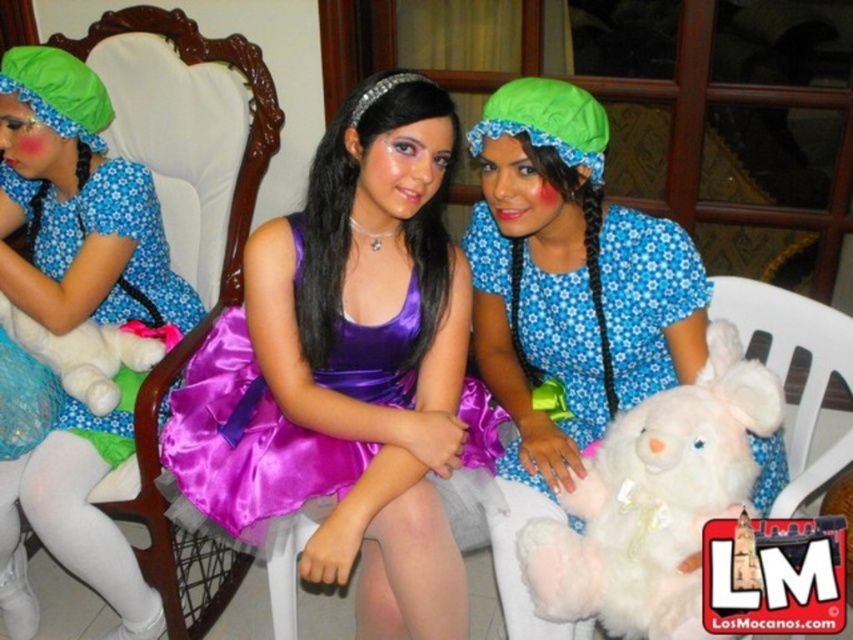
You are a photographer setting up for a group photo. You notice the purple satin dress at center and the white plush bear at center. Based on their positions, which object should you focus on first if you want to capture both in the frame without moving the camera?

The purple satin dress at center is to the left of the white plush bear at center, so you should focus on the purple satin dress at center first to ensure both are in the frame without moving the camera.

You are a photographer arranging two matte blue dresses for a photoshoot. The scene requires the wider dress to be placed on the right side. Currently, the matte blue dress at center and the matte blue dress at left are positioned as described. Which dress should you move to the right to meet the requirement?

The matte blue dress at center has a larger width than the matte blue dress at left. To meet the requirement, move the matte blue dress at center to the right side.